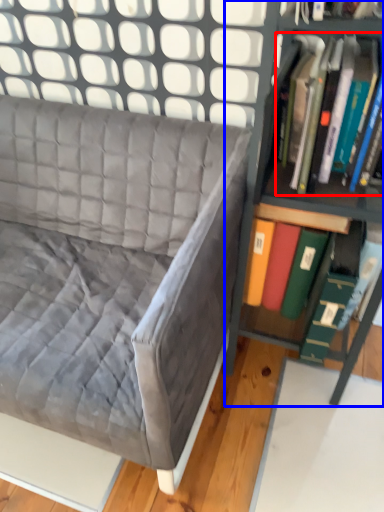
Question: Which object is further to the camera taking this photo, book (highlighted by a red box) or shelf (highlighted by a blue box)?

Choices:
 (A) book
 (B) shelf

Answer: (A)